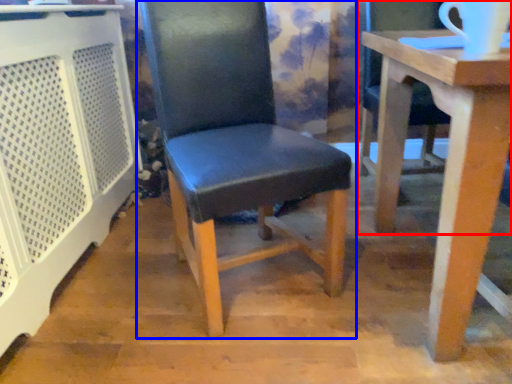
Question: Among these objects, which one is nearest to the camera, chair (highlighted by a red box) or chair (highlighted by a blue box)?

Choices:
 (A) chair
 (B) chair

Answer: (A)